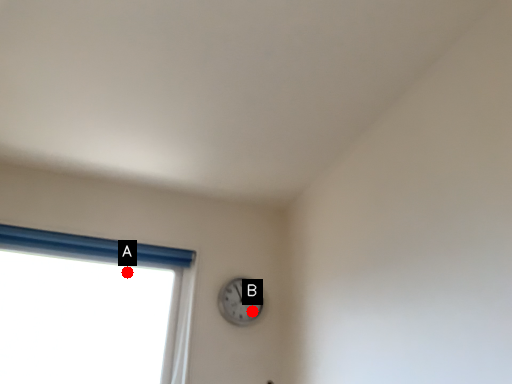
Question: Two points are circled on the image, labeled by A and B beside each circle. Among these points, which one is nearest to the camera?

Choices:
 (A) A is closer
 (B) B is closer

Answer: (B)